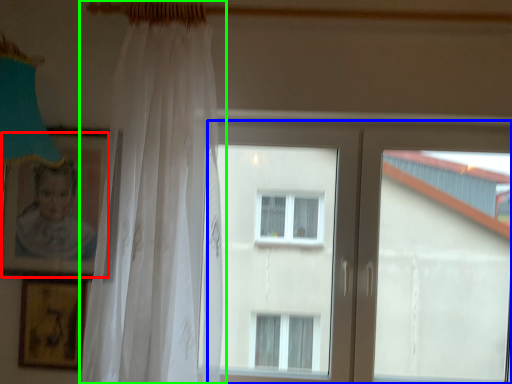
Question: Based on their relative distances, which object is nearer to picture frame (highlighted by a red box)? Choose from window (highlighted by a blue box) and curtain (highlighted by a green box).

Choices:
 (A) window
 (B) curtain

Answer: (B)